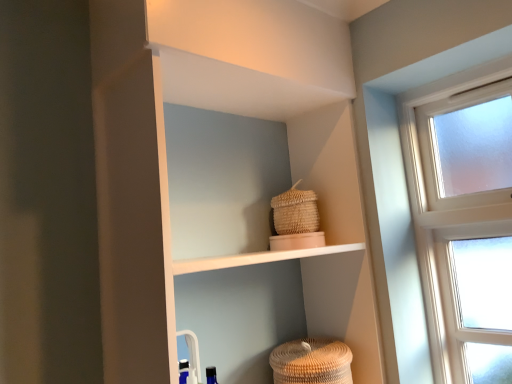
Question: Should I look upward or downward to see woven straw basket at upper center, the first basket viewed from the top?

Choices:
 (A) up
 (B) down

Answer: (B)

Question: From a real-world perspective, is woven straw basket at upper center, which ranks as the 2th basket in bottom-to-top order, on top of white matte shelf at upper center?

Choices:
 (A) yes
 (B) no

Answer: (A)

Question: Is woven straw basket at upper center, the first basket viewed from the top, thinner than white matte shelf at upper center?

Choices:
 (A) no
 (B) yes

Answer: (B)

Question: Is woven straw basket at upper center, which ranks as the 2th basket in bottom-to-top order, taller than white matte shelf at upper center?

Choices:
 (A) no
 (B) yes

Answer: (A)

Question: Is white matte shelf at upper center at the back of woven straw basket at upper center, which ranks as the 2th basket in bottom-to-top order?

Choices:
 (A) yes
 (B) no

Answer: (A)

Question: Considering the relative positions of woven straw basket at upper center, which ranks as the 2th basket in bottom-to-top order, and white matte shelf at upper center in the image provided, is woven straw basket at upper center, which ranks as the 2th basket in bottom-to-top order, to the right of white matte shelf at upper center from the viewer's perspective?

Choices:
 (A) no
 (B) yes

Answer: (B)

Question: Are woven straw basket at upper center, which ranks as the 2th basket in bottom-to-top order, and white matte shelf at upper center making contact?

Choices:
 (A) yes
 (B) no

Answer: (B)

Question: From a real-world perspective, is white matte shelf at upper center located beneath brown woven basket at lower center, the first basket when ordered from bottom to top?

Choices:
 (A) no
 (B) yes

Answer: (A)

Question: Is white matte shelf at upper center thinner than brown woven basket at lower center, which is counted as the 2th basket, starting from the top?

Choices:
 (A) yes
 (B) no

Answer: (B)

Question: Is brown woven basket at lower center, which is counted as the 2th basket, starting from the top, a part of white matte shelf at upper center?

Choices:
 (A) yes
 (B) no

Answer: (A)

Question: Considering the relative sizes of white matte shelf at upper center and brown woven basket at lower center, which is counted as the 2th basket, starting from the top, in the image provided, is white matte shelf at upper center taller than brown woven basket at lower center, which is counted as the 2th basket, starting from the top,?

Choices:
 (A) no
 (B) yes

Answer: (B)

Question: From the image's perspective, is white matte shelf at upper center under brown woven basket at lower center, which is counted as the 2th basket, starting from the top?

Choices:
 (A) yes
 (B) no

Answer: (B)

Question: Is white matte shelf at upper center shorter than brown woven basket at lower center, the first basket when ordered from bottom to top?

Choices:
 (A) no
 (B) yes

Answer: (A)

Question: Is white matte shelf at upper center a part of brown woven basket at lower center, the first basket when ordered from bottom to top?

Choices:
 (A) yes
 (B) no

Answer: (B)